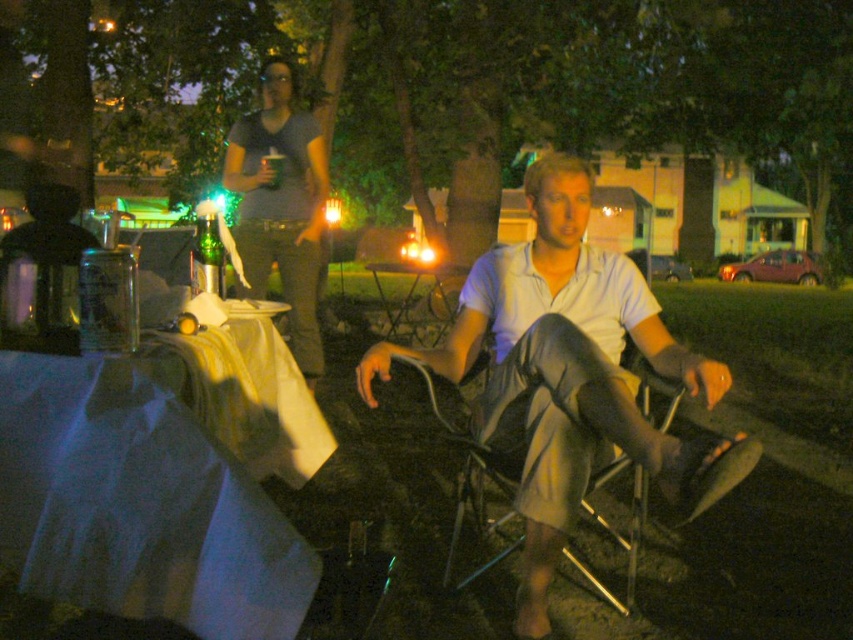
Which is above, light blue cotton shirt at center or metallic silver chair at center?

Positioned higher is light blue cotton shirt at center.

Is light blue cotton shirt at center positioned at the back of metallic silver chair at center?

No, it is not.

Where is `light blue cotton shirt at center`? This screenshot has height=640, width=853. light blue cotton shirt at center is located at coordinates (570, 376).